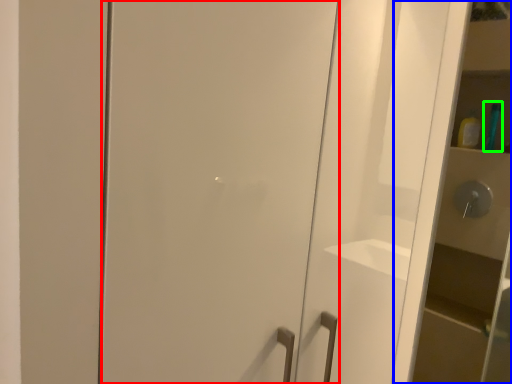
Question: Which is farther away from door (highlighted by a red box)? cabinetry (highlighted by a blue box) or toiletry (highlighted by a green box)?

Choices:
 (A) cabinetry
 (B) toiletry

Answer: (B)